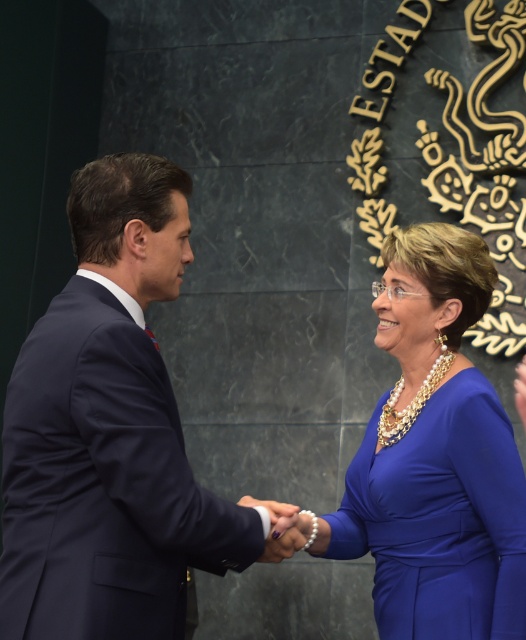
Question: Among these points, which one is nearest to the camera?

Choices:
 (A) (523, 365)
 (B) (483, 280)
 (C) (246, 561)

Answer: (C)

Question: Is navy blue suit at center positioned at the back of blue satin dress at center?

Choices:
 (A) yes
 (B) no

Answer: (B)

Question: Is blue satin dress at center further to camera compared to smooth leather hand at center?

Choices:
 (A) yes
 (B) no

Answer: (B)

Question: Among these objects, which one is nearest to the camera?

Choices:
 (A) navy blue suit at center
 (B) smooth leather hand at center
 (C) blue satin dress at center

Answer: (A)

Question: Which object is closer to the camera taking this photo?

Choices:
 (A) blue satin dress at center
 (B) smooth leather hand at center
 (C) navy blue suit at center

Answer: (C)

Question: Does navy blue suit at center appear on the right side of smooth leather hand at center?

Choices:
 (A) no
 (B) yes

Answer: (A)